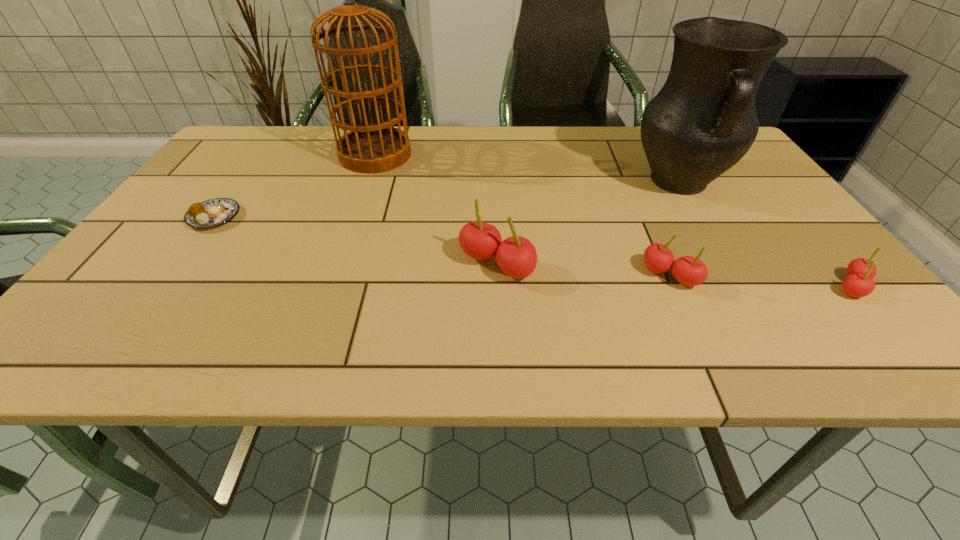
The image size is (960, 540). What are the coordinates of `vacant area that lies between the rightmost cherry and the fifth object from right to left` in the screenshot? It's located at tap(613, 221).

Locate an element on the screen. Image resolution: width=960 pixels, height=540 pixels. free space between the tallest object and the tallest cherry is located at coordinates (436, 210).

At what (x,y) coordinates should I click in order to perform the action: click on free space between the rightmost object and the third shortest object. Please return your answer as a coordinate pair (x, y). Looking at the image, I should click on (760, 281).

The width and height of the screenshot is (960, 540). In order to click on empty space that is in between the second object from left to right and the rightmost object in this screenshot , I will do `click(613, 221)`.

You are a GUI agent. You are given a task and a screenshot of the screen. Output one action in this format:
    pyautogui.click(x=<x>, y=<y>)
    Task: Click on the free space between the pastry and the fourth tallest object
    
    Given the screenshot: What is the action you would take?
    pyautogui.click(x=443, y=246)

Identify the location of free space that is in between the shortest cherry and the second cherry from left to right. (760, 281).

This screenshot has height=540, width=960. In order to click on vacant space that's between the tallest object and the leftmost object in this screenshot , I will do `click(295, 186)`.

Locate an element on the screen. The image size is (960, 540). object that stands as the second closest to the tallest cherry is located at coordinates (702, 122).

Identify which object is the closest to the fifth object from right to left. Please provide its 2D coordinates. Your answer should be formatted as a tuple, i.e. [(x, y)], where the tuple contains the x and y coordinates of a point satisfying the conditions above.

[(210, 213)]

The width and height of the screenshot is (960, 540). Find the location of `cherry object that ranks as the second closest to the tallest object`. cherry object that ranks as the second closest to the tallest object is located at coordinates (690, 271).